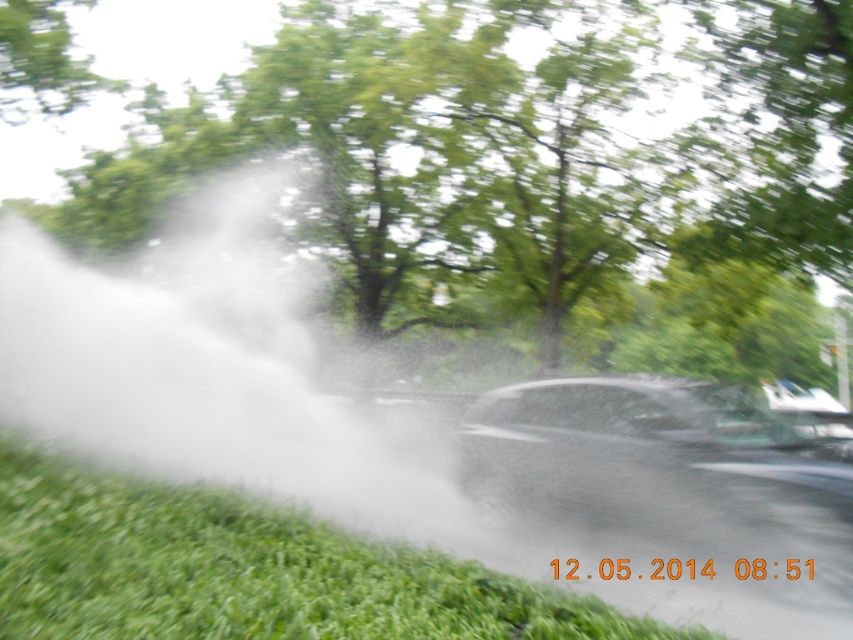
Question: Where is white mist at center located in relation to shiny black car at center in the image?

Choices:
 (A) above
 (B) below

Answer: (A)

Question: Does white mist at center appear under shiny black car at center?

Choices:
 (A) yes
 (B) no

Answer: (B)

Question: Which object is the farthest from the white mist at center?

Choices:
 (A) shiny black car at center
 (B) green grass at lower left

Answer: (A)

Question: Can you confirm if white mist at center is wider than green grass at lower left?

Choices:
 (A) no
 (B) yes

Answer: (B)

Question: Which of the following is the closest to the observer?

Choices:
 (A) (260, 445)
 (B) (686, 476)

Answer: (B)

Question: Which object is positioned closest to the green grass at lower left?

Choices:
 (A) shiny black car at center
 (B) white mist at center

Answer: (A)